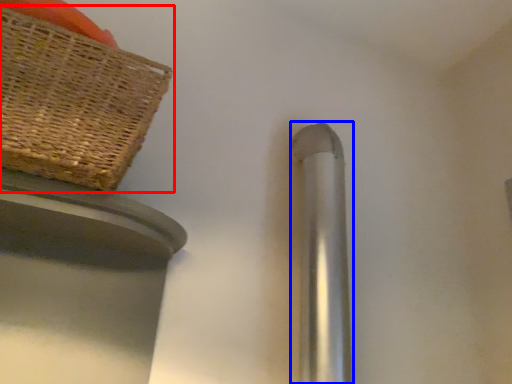
Question: Which object is further to the camera taking this photo, picnic basket (highlighted by a red box) or door handle (highlighted by a blue box)?

Choices:
 (A) picnic basket
 (B) door handle

Answer: (B)